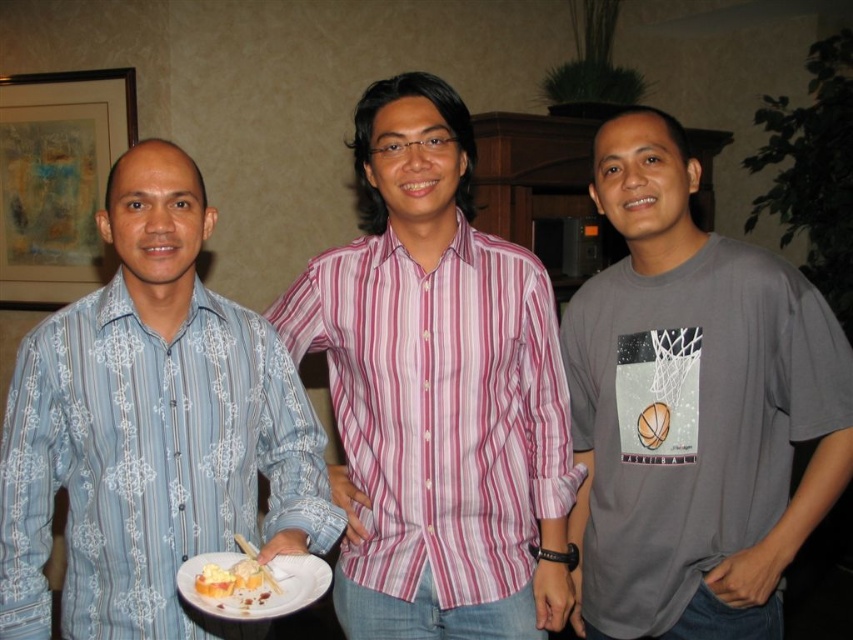
From the picture: You are standing in the room and want to move from the point at coordinates [467,422] to the point at [730,326]. Which direction should you move in to get closer to your destination?

To move from point [467,422] to point [730,326], you should move upward and to the left since point [730,326] is located above and to the left of point [467,422].

You are a photographer at this event and want to capture a photo that includes both the blue printed shirt at left and the white matte plate at center. Based on their positions, which object should you focus on first to ensure both are in the frame?

The blue printed shirt at left is located above the white matte plate at center, so you should focus on the white matte plate at center first to ensure both are in the frame.